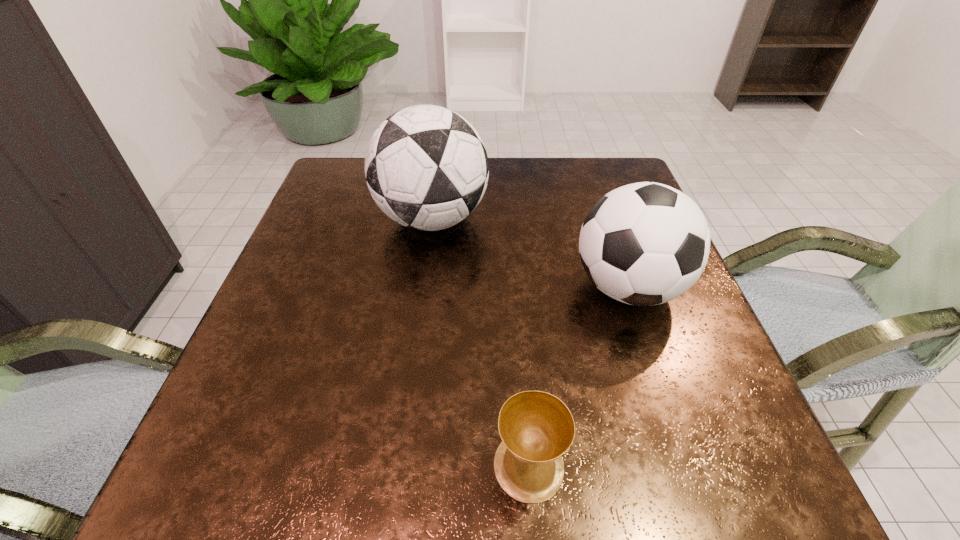
The height and width of the screenshot is (540, 960). Identify the location of free point between the second shortest object and the left soccer ball. (530, 253).

This screenshot has height=540, width=960. What are the coordinates of `free space between the right soccer ball and the left soccer ball` in the screenshot? It's located at (530, 253).

Locate an element on the screen. Image resolution: width=960 pixels, height=540 pixels. free space between the tallest object and the chalice is located at coordinates [481, 342].

Image resolution: width=960 pixels, height=540 pixels. I want to click on free space that is in between the right soccer ball and the tallest object, so click(530, 253).

This screenshot has height=540, width=960. What are the coordinates of `empty location between the chalice and the rightmost object` in the screenshot? It's located at (578, 376).

The height and width of the screenshot is (540, 960). What are the coordinates of `empty location between the shortest object and the right soccer ball` in the screenshot? It's located at (578, 376).

Locate an element on the screen. The image size is (960, 540). free space between the left soccer ball and the right soccer ball is located at coordinates (530, 253).

Find the location of `free space between the shorter soccer ball and the second object from right to left`. free space between the shorter soccer ball and the second object from right to left is located at coordinates (578, 376).

Locate an element on the screen. the closest object to the left soccer ball is located at coordinates (646, 243).

Where is `object that stands as the second closest to the taller soccer ball`? The width and height of the screenshot is (960, 540). object that stands as the second closest to the taller soccer ball is located at coordinates (537, 428).